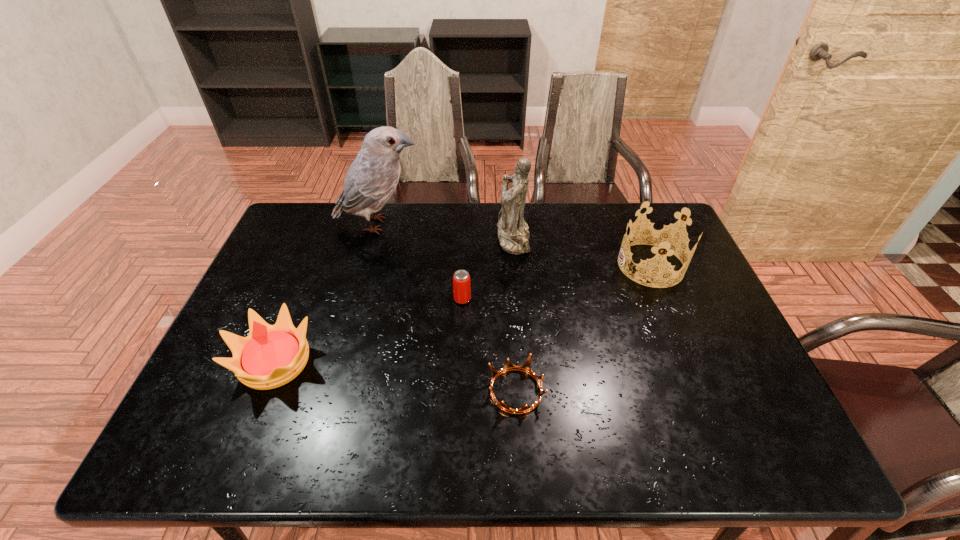
This screenshot has height=540, width=960. Identify the location of vacant point located between the shortest object and the figurine. (515, 314).

Locate an element on the screen. The image size is (960, 540). empty space that is in between the leftmost crown and the parrot is located at coordinates (327, 293).

You are a GUI agent. You are given a task and a screenshot of the screen. Output one action in this format:
    pyautogui.click(x=<x>, y=<y>)
    Task: Click on the free point between the parrot and the leftmost crown
    
    Given the screenshot: What is the action you would take?
    pyautogui.click(x=327, y=293)

Find the location of a particular element. free point between the rightmost crown and the fifth shortest object is located at coordinates (582, 252).

Locate an element on the screen. Image resolution: width=960 pixels, height=540 pixels. vacant area between the fourth object from right to left and the parrot is located at coordinates pos(420,262).

I want to click on vacant region between the fifth shortest object and the second crown from right to left, so click(x=515, y=314).

The height and width of the screenshot is (540, 960). In order to click on vacant space that is in between the second tallest object and the leftmost crown in this screenshot , I will do `click(394, 300)`.

Identify the location of vacant space in between the fifth shortest object and the shortest crown. The height and width of the screenshot is (540, 960). (515, 314).

Choose which object is the fourth nearest neighbor to the rightmost crown. Please provide its 2D coordinates. Your answer should be formatted as a tuple, i.e. [(x, y)], where the tuple contains the x and y coordinates of a point satisfying the conditions above.

[(371, 179)]

Where is `object that stands as the third closest to the figurine`? object that stands as the third closest to the figurine is located at coordinates (660, 239).